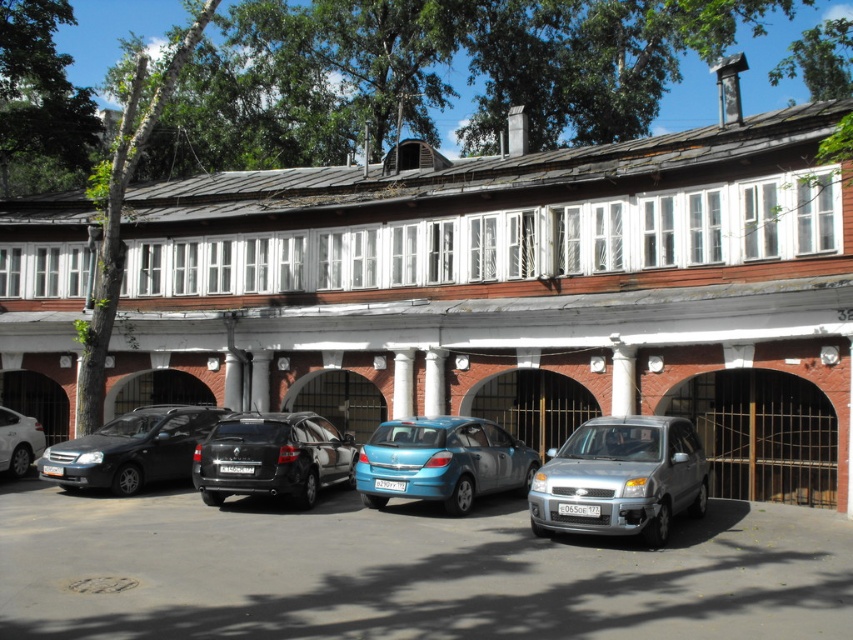
Is shiny silver sedan at left further to camera compared to white marble column at center?

No.

Between shiny silver sedan at left and white marble column at center, which one has more height?

white marble column at center is taller.

What do you see at coordinates (18, 442) in the screenshot? I see `shiny silver sedan at left` at bounding box center [18, 442].

Where is `shiny silver sedan at left`? This screenshot has height=640, width=853. shiny silver sedan at left is located at coordinates (18, 442).

Which is more to the right, brown wooden building at center or shiny silver sedan at left?

Positioned to the right is brown wooden building at center.

Who is shorter, brown wooden building at center or shiny silver sedan at left?

shiny silver sedan at left is shorter.

Which is in front, point (648, 364) or point (9, 468)?

Point (9, 468)

This screenshot has height=640, width=853. In order to click on brown wooden building at center in this screenshot , I will do `click(521, 292)`.

Which of these two, silver metallic hatchback at center or shiny silver sedan at left, stands taller?

Standing taller between the two is silver metallic hatchback at center.

This screenshot has height=640, width=853. What do you see at coordinates (619, 477) in the screenshot? I see `silver metallic hatchback at center` at bounding box center [619, 477].

In order to click on silver metallic hatchback at center in this screenshot , I will do `click(619, 477)`.